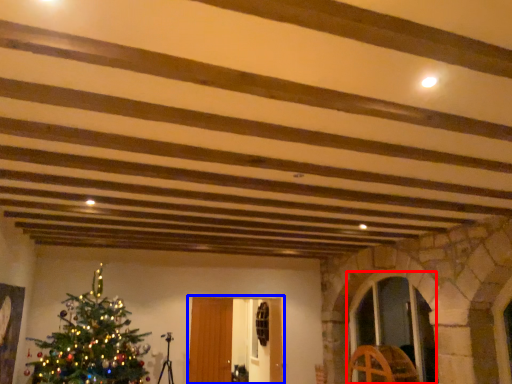
Question: Which point is further to the camera, glass door (highlighted by a red box) or glass door (highlighted by a blue box)?

Choices:
 (A) glass door
 (B) glass door

Answer: (B)